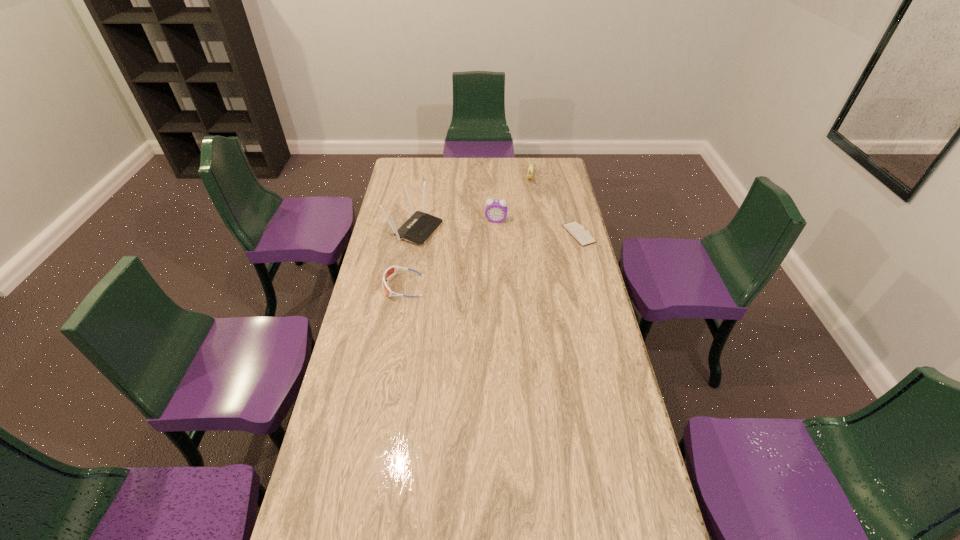
Find the location of a particular element. Image resolution: width=960 pixels, height=540 pixels. free space between the alarm clock and the nearest object is located at coordinates (450, 253).

Where is `vacant space that is in between the second shortest object and the router`? The image size is (960, 540). vacant space that is in between the second shortest object and the router is located at coordinates (409, 258).

Identify the location of free space between the alarm clock and the nearest object. This screenshot has height=540, width=960. (450, 253).

The width and height of the screenshot is (960, 540). Identify the location of vacant space that's between the nearest object and the tallest object. (409, 258).

The image size is (960, 540). I want to click on unoccupied position between the second shortest object and the tallest object, so click(409, 258).

In order to click on free spot between the router and the second shortest object in this screenshot , I will do `click(409, 258)`.

Locate an element on the screen. vacant point located between the fourth object from left to right and the shortest object is located at coordinates (554, 206).

This screenshot has height=540, width=960. I want to click on vacant point located between the router and the shortest object, so click(496, 231).

Where is `free space between the fourth shortest object and the diary`? free space between the fourth shortest object and the diary is located at coordinates (538, 227).

Locate an element on the screen. The image size is (960, 540). vacant area that lies between the tallest object and the rightmost object is located at coordinates (496, 231).